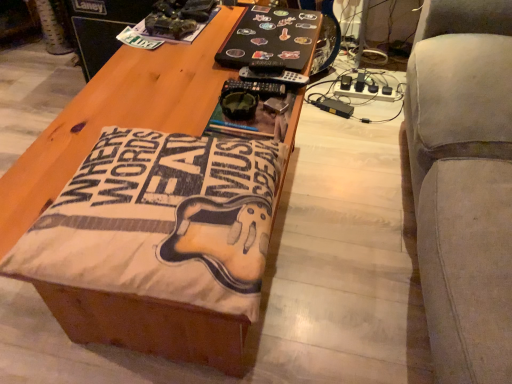
Describe the element at coordinates (115, 115) in the screenshot. I see `wooden table at center` at that location.

I want to click on wooden table at center, so click(x=115, y=115).

Locate an element on the screen. The height and width of the screenshot is (384, 512). beige fabric couch at right is located at coordinates (464, 184).

What is the approximate width of beige fabric couch at right?

beige fabric couch at right is 59.09 centimeters wide.

This screenshot has height=384, width=512. What do you see at coordinates (464, 184) in the screenshot?
I see `beige fabric couch at right` at bounding box center [464, 184].

Image resolution: width=512 pixels, height=384 pixels. In order to click on wooden table at center in this screenshot , I will do `click(115, 115)`.

Which object is positioned more to the right, beige fabric couch at right or wooden table at center?

beige fabric couch at right is more to the right.

Is beige fabric couch at right positioned behind wooden table at center?

That is False.

Is point (499, 296) more distant than point (32, 179)?

No.

From the image's perspective, which one is positioned higher, beige fabric couch at right or wooden table at center?

From the image's view, beige fabric couch at right is above.

From a real-world perspective, who is located lower, beige fabric couch at right or wooden table at center?

In real-world perspective, beige fabric couch at right is lower.

Considering the sizes of beige fabric couch at right and wooden table at center in the image, is beige fabric couch at right wider or thinner than wooden table at center?

In the image, beige fabric couch at right appears to be wider than wooden table at center.

Consider the image. Can you confirm if beige fabric couch at right is taller than wooden table at center?

Correct, beige fabric couch at right is much taller as wooden table at center.

Who is bigger, beige fabric couch at right or wooden table at center?

Bigger between the two is beige fabric couch at right.

Is beige fabric couch at right not inside wooden table at center?

Yes.

Is beige fabric couch at right far away from wooden table at center?

beige fabric couch at right is actually quite close to wooden table at center.

Is wooden table at center at the back of beige fabric couch at right?

No.

How different are the orientations of beige fabric couch at right and wooden table at center in degrees?

The facing directions of beige fabric couch at right and wooden table at center are 2.05 degrees apart.

Measure the distance from beige fabric couch at right to wooden table at center.

They are 25.56 inches apart.

The height and width of the screenshot is (384, 512). What are the coordinates of `furniture below the wooden table at center (from a real-world perspective)` in the screenshot? It's located at (464, 184).

Considering the relative positions of wooden table at center and beige fabric couch at right in the image provided, is wooden table at center to the left of beige fabric couch at right from the viewer's perspective?

Yes, wooden table at center is to the left of beige fabric couch at right.

Is wooden table at center further to camera compared to beige fabric couch at right?

That is True.

Between point (152, 116) and point (471, 250), which one is positioned behind?

The point (152, 116) is farther from the camera.

From the image's perspective, which one is positioned higher, wooden table at center or beige fabric couch at right?

beige fabric couch at right is shown above in the image.

From a real-world perspective, does wooden table at center stand above beige fabric couch at right?

Yes, from a real-world perspective, wooden table at center is over beige fabric couch at right

Considering the sizes of wooden table at center and beige fabric couch at right in the image, is wooden table at center wider or thinner than beige fabric couch at right?

In the image, wooden table at center appears to be more narrow than beige fabric couch at right.

Considering the relative sizes of wooden table at center and beige fabric couch at right in the image provided, is wooden table at center shorter than beige fabric couch at right?

Yes.

Considering the sizes of objects wooden table at center and beige fabric couch at right in the image provided, who is bigger, wooden table at center or beige fabric couch at right?

With larger size is beige fabric couch at right.

Is wooden table at center inside the boundaries of beige fabric couch at right, or outside?

wooden table at center cannot be found inside beige fabric couch at right.

Is there a large distance between wooden table at center and beige fabric couch at right?

No, wooden table at center is in close proximity to beige fabric couch at right.

Does wooden table at center turn towards beige fabric couch at right?

No, wooden table at center is not facing towards beige fabric couch at right.

Can you tell me how much wooden table at center and beige fabric couch at right differ in facing direction?

The angle between the facing direction of wooden table at center and the facing direction of beige fabric couch at right is 2.05 degrees.

How much distance is there between wooden table at center and beige fabric couch at right?

The distance of wooden table at center from beige fabric couch at right is 64.93 centimeters.

I want to click on furniture that is above the wooden table at center (from the image's perspective), so (x=464, y=184).

Where is `furniture lying on the right of wooden table at center`? furniture lying on the right of wooden table at center is located at coordinates (464, 184).

Image resolution: width=512 pixels, height=384 pixels. Identify the location of furniture that is under the wooden table at center (from a real-world perspective). (464, 184).